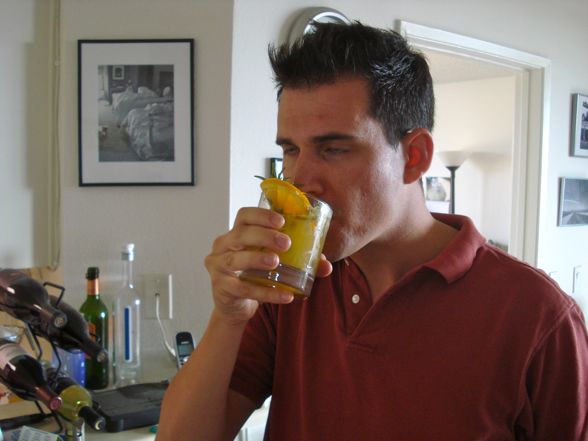
Find the location of a particular element. Image resolution: width=588 pixels, height=441 pixels. wall is located at coordinates (542, 25), (213, 52).